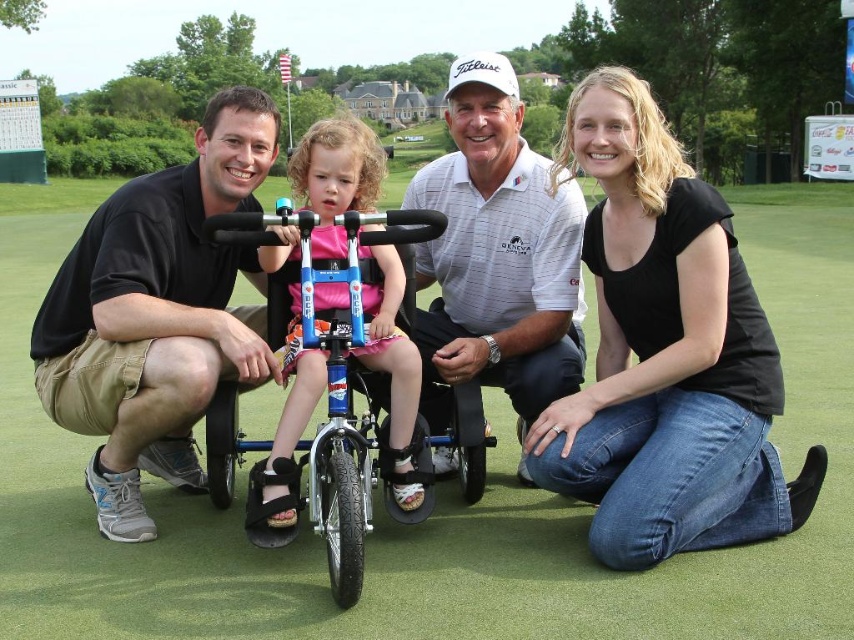
Question: Does black cotton shirt at lower right come behind white textured polo shirt at center?

Choices:
 (A) no
 (B) yes

Answer: (B)

Question: Based on their relative distances, which object is nearer to the black cotton shirt at lower right?

Choices:
 (A) blue metallic wheelchair at center
 (B) black cotton shirt at left

Answer: (A)

Question: Can you confirm if black cotton shirt at lower right is positioned to the right of white textured polo shirt at center?

Choices:
 (A) no
 (B) yes

Answer: (B)

Question: Is black cotton shirt at left to the left of white textured polo shirt at center from the viewer's perspective?

Choices:
 (A) yes
 (B) no

Answer: (A)

Question: Which object is the farthest from the black cotton shirt at lower right?

Choices:
 (A) blue metallic wheelchair at center
 (B) white textured polo shirt at center
 (C) pink fabric shirt at center
 (D) green artificial turf at center

Answer: (D)

Question: Among these points, which one is farthest from the camera?

Choices:
 (A) (205, 184)
 (B) (635, 138)
 (C) (507, 218)
 (D) (296, 173)

Answer: (C)